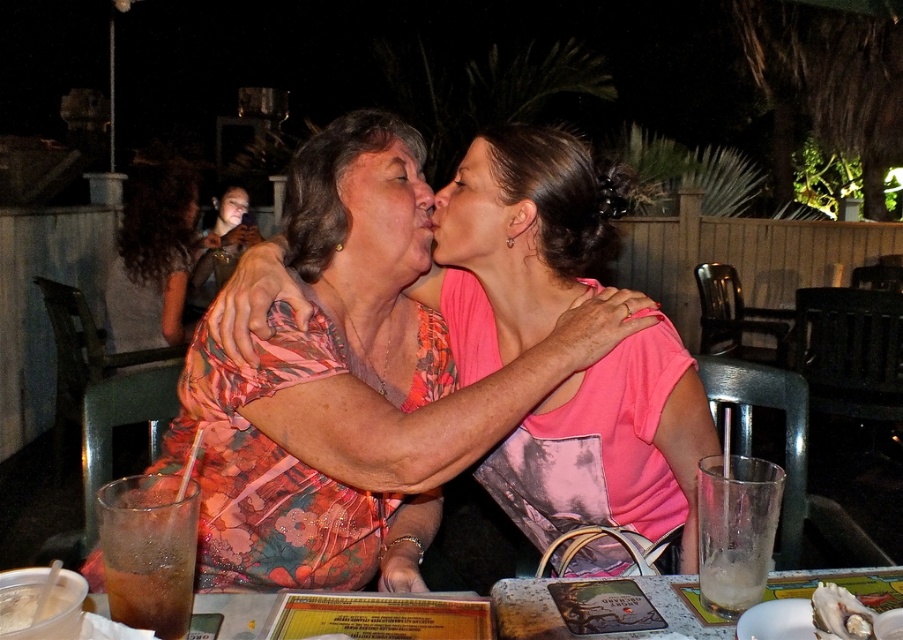
You are standing at the entrance of the outdoor dining area and want to greet both women wearing floral patterns. The entrance is closest to which floral clothing item, the floral fabric blouse at upper left or the matte floral shirt at center?

The entrance is closest to the floral fabric blouse at upper left because it is only 7.66 feet away from the matte floral shirt at center, meaning the blouse is positioned closer to the entrance than the shirt.

Looking at this image, you are a fashion designer observing this nighttime scene between two women. You notice the floral fabric blouse at upper left and the matte floral shirt at center. Which clothing item has a greater width?

The floral fabric blouse at upper left has a greater width than the matte floral shirt at center.

In the nighttime outdoor dining scene, there are two women wearing floral clothing. The first is wearing a floral fabric blouse at upper left, and the second has a matte floral shirt at center. Based on the image, which of these two clothing items is positioned to the left?

The floral fabric blouse at upper left is positioned to the left of the matte floral shirt at center.